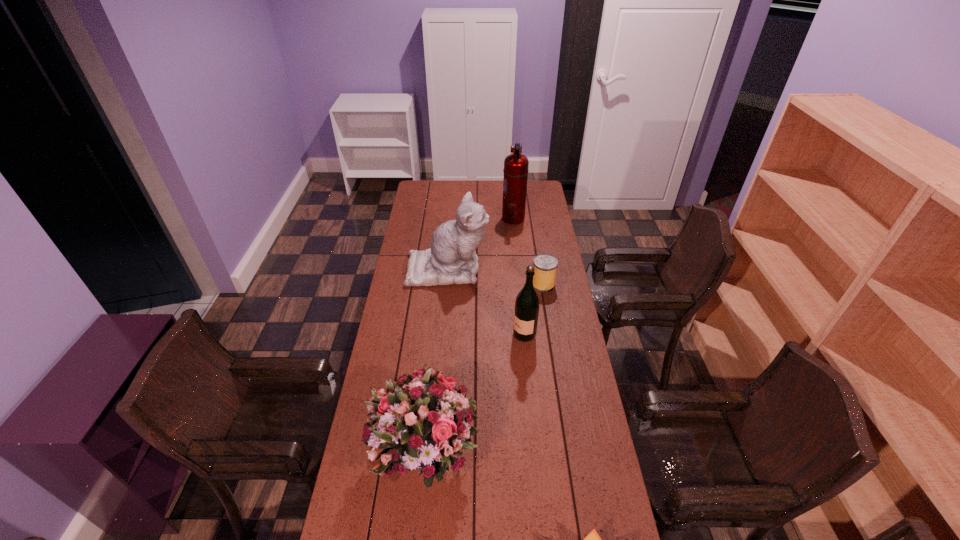
This screenshot has width=960, height=540. I want to click on fire extinguisher, so pyautogui.click(x=516, y=165).

The width and height of the screenshot is (960, 540). What are the coordinates of `cat` in the screenshot? It's located at (452, 259).

Where is `the third nearest object`? the third nearest object is located at coordinates (526, 312).

Locate an element on the screen. The image size is (960, 540). the fifth farthest object is located at coordinates (423, 418).

Locate an element on the screen. The width and height of the screenshot is (960, 540). can is located at coordinates (545, 265).

Image resolution: width=960 pixels, height=540 pixels. I want to click on vacant space located on the nozzle side of the farthest object, so click(454, 218).

Identify the location of vacant position located 0.120m on the nozzle side of the farthest object. The height and width of the screenshot is (540, 960). [x=480, y=218].

The height and width of the screenshot is (540, 960). Find the location of `vacant space located on the nozzle side of the farthest object`. vacant space located on the nozzle side of the farthest object is located at coordinates (458, 218).

Find the location of a particular element. Image resolution: width=960 pixels, height=540 pixels. vacant space located on the front-facing side of the cat is located at coordinates (510, 268).

Locate an element on the screen. free space located on the front-facing side of the liquor is located at coordinates (473, 335).